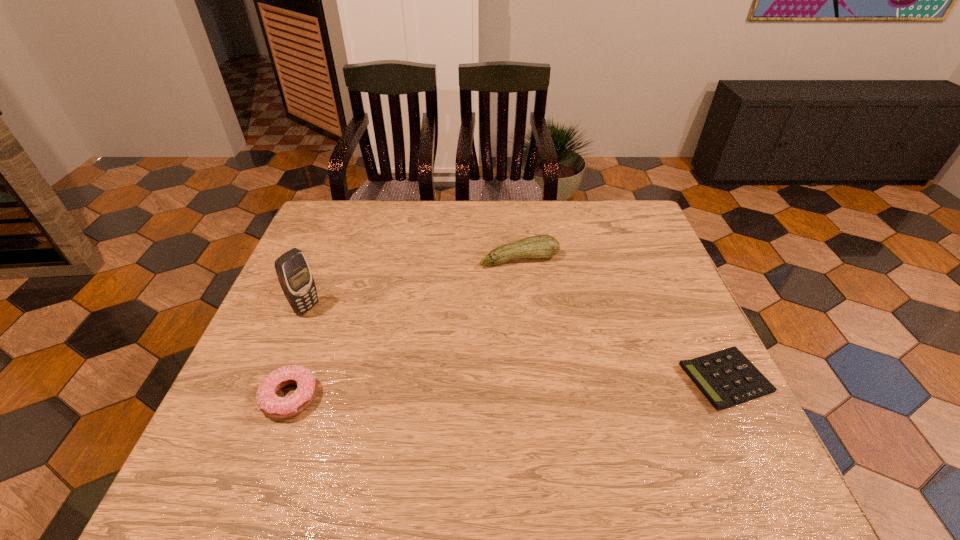
Image resolution: width=960 pixels, height=540 pixels. What are the coordinates of `free space on the desktop that is between the third tallest object and the rightmost object and is positioned on the front face of the cellular telephone` in the screenshot? It's located at (459, 390).

Identify the location of free space on the desktop that is between the second shortest object and the rightmost object and is positioned at the stem end of the second tallest object. (574, 385).